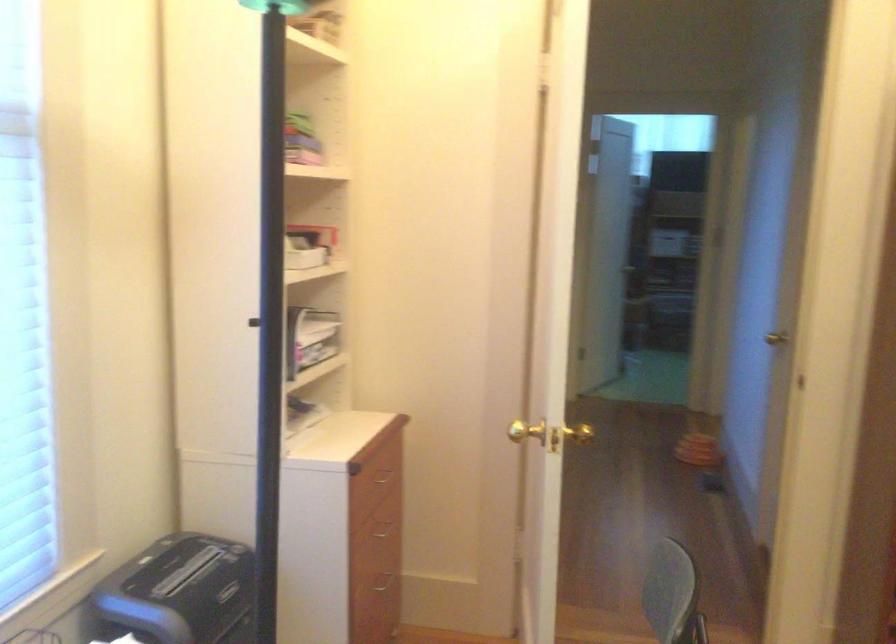
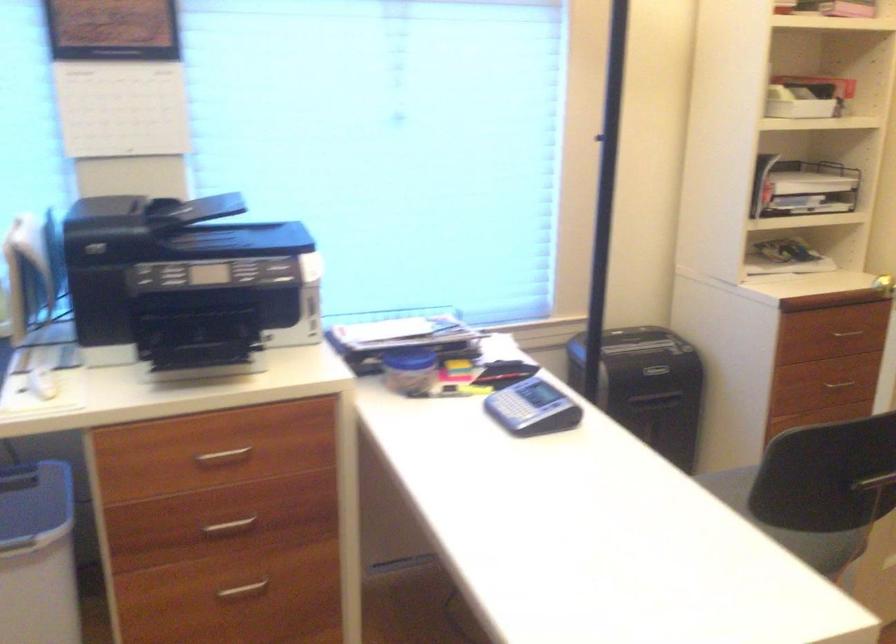
Locate, in the second image, the point that corresponds to [384,480] in the first image.

(847, 333)